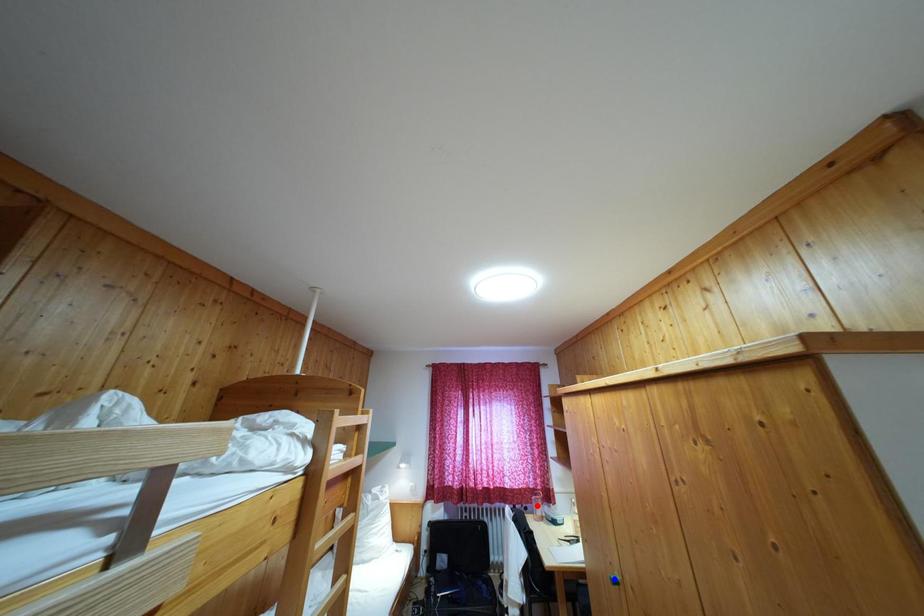
Question: Which of the two points in the image is closer to the camera?

Choices:
 (A) Blue point is closer.
 (B) Red point is closer.

Answer: (A)